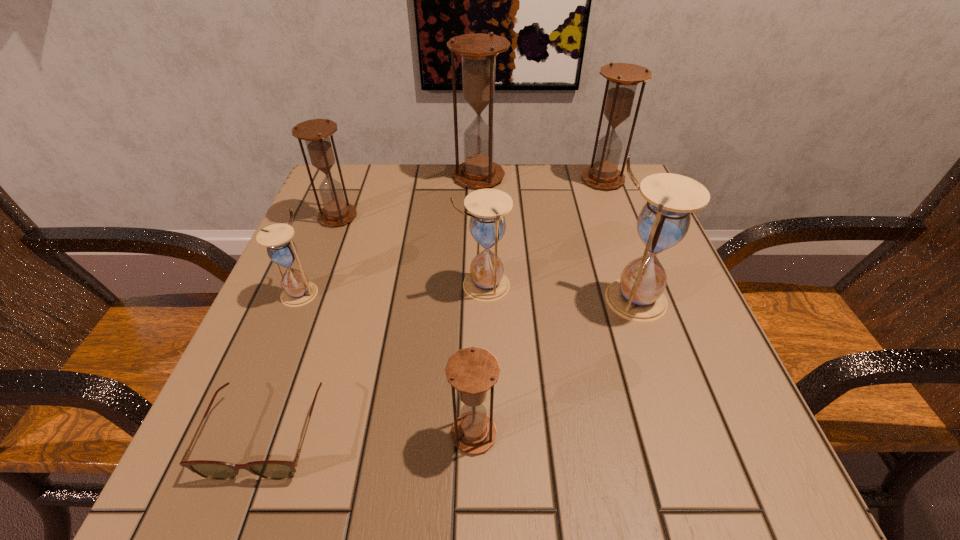
Where is `the tallest hourglass`? Image resolution: width=960 pixels, height=540 pixels. the tallest hourglass is located at coordinates (478, 51).

The height and width of the screenshot is (540, 960). What are the coordinates of `the tallest object` in the screenshot? It's located at (478, 51).

Locate an element on the screen. the rightmost brown hourglass is located at coordinates (622, 78).

Locate an element on the screen. the rightmost white hourglass is located at coordinates (663, 222).

Identify the location of the leftmost brown hourglass. This screenshot has height=540, width=960. (315, 132).

Locate an element on the screen. The width and height of the screenshot is (960, 540). the second smallest brown hourglass is located at coordinates (315, 132).

The height and width of the screenshot is (540, 960). Identify the location of the second white hourglass from left to right. (486, 282).

Identify the location of the leftmost white hourglass. This screenshot has height=540, width=960. (297, 291).

The height and width of the screenshot is (540, 960). In order to click on the smallest brown hourglass in this screenshot , I will do `click(472, 371)`.

You are a GUI agent. You are given a task and a screenshot of the screen. Output one action in this format:
    pyautogui.click(x=<x>, y=<y>)
    Task: Click on the nearest brown hourglass
    
    Given the screenshot: What is the action you would take?
    pyautogui.click(x=472, y=371)